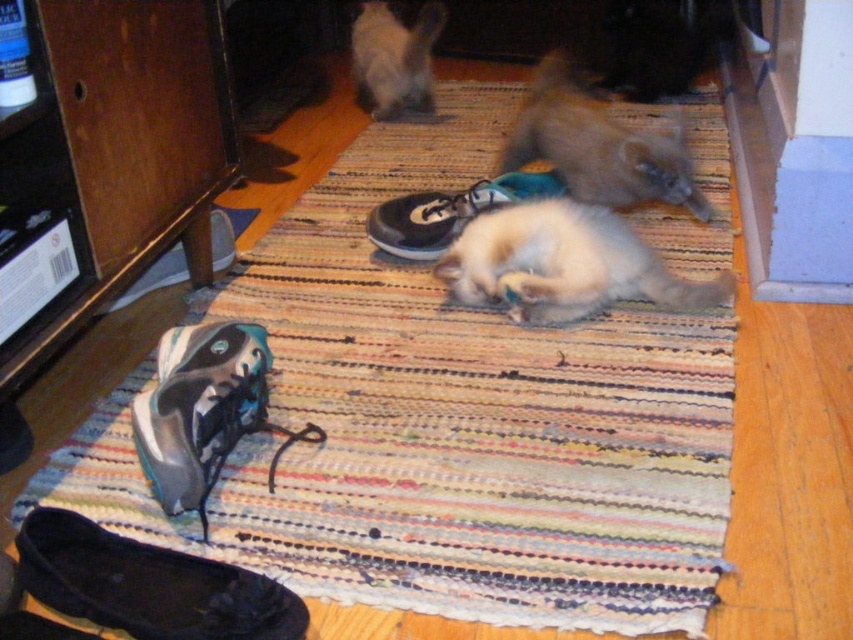
You are trying to decide whether to place a new small plant pot between the black suede running shoe at lower left and the fuzzy brown cat at center. Based on their sizes, will the plant pot fit comfortably without overcrowding the space?

The black suede running shoe at lower left is smaller than the fuzzy brown cat at center. Since the shoe is smaller, there should be enough space between them to place the plant pot comfortably without overcrowding.

You are a photographer trying to capture both the fluffy white cat at center and the fuzzy white cat at upper center in a single shot. Based on their positions, which cat should you focus on first to ensure both are in the frame?

The fluffy white cat at center is below the fuzzy white cat at upper center, so you should focus on the fuzzy white cat at upper center first to ensure both are in the frame.